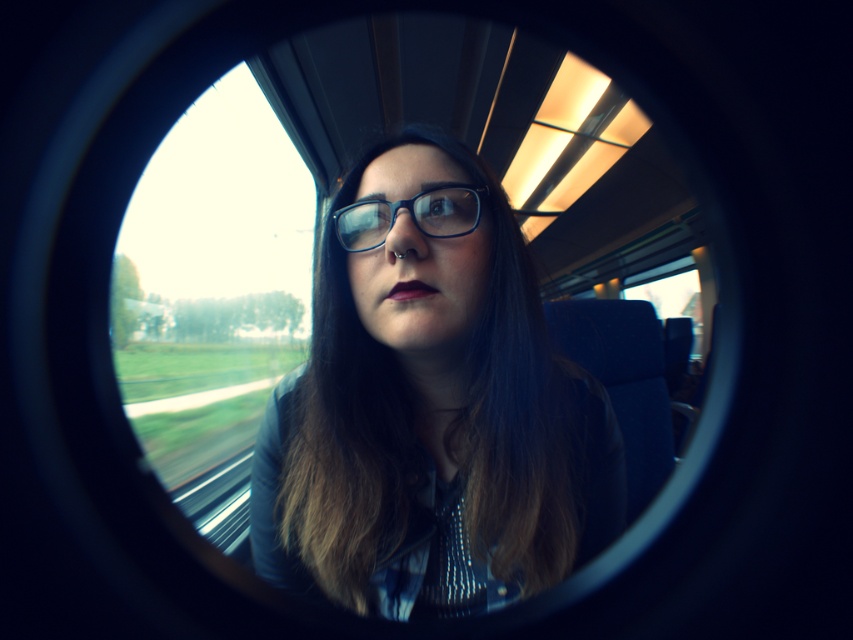
You are a passenger on the train and want to place a small keychain exactly where the matte blue glasses at center are currently positioned. What coordinates should you aim for to place the keychain?

The coordinates for the matte blue glasses at center are at point (x=430, y=406), so you should aim for those coordinates to place the keychain.

You are a passenger on the train and want to take a photo of the landscape outside. The matte blue glasses at center and transparent glass window at center are both in your view. Which object should you use to frame your photo for the clearest view?

You should use the transparent glass window at center because it allows for a clearer view of the landscape outside, as the matte blue glasses at center are likely obstructive and occupy less space.